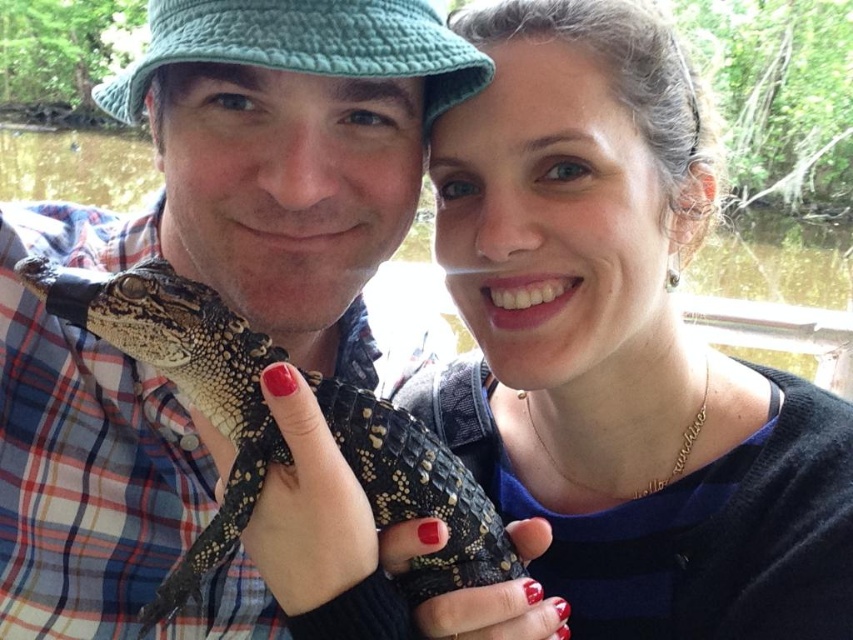
Question: From the image, what is the correct spatial relationship of matte black reptile at center in relation to slick black reptile at center?

Choices:
 (A) right
 (B) left

Answer: (A)

Question: Can you confirm if matte black reptile at center is thinner than slick black reptile at center?

Choices:
 (A) no
 (B) yes

Answer: (B)

Question: Which of the following is the closest to the observer?

Choices:
 (A) matte black reptile at center
 (B) slick black reptile at center

Answer: (A)

Question: Is matte black reptile at center to the right of slick black reptile at center from the viewer's perspective?

Choices:
 (A) yes
 (B) no

Answer: (A)

Question: Which object appears closest to the camera in this image?

Choices:
 (A) matte black reptile at center
 (B) slick black reptile at center

Answer: (A)